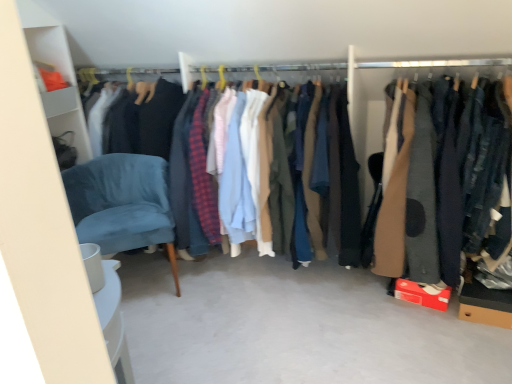
At what (x,y) coordinates should I click in order to perform the action: click on vacant area that lies between matte cotton shirts at center, which appears as the first clothing when viewed from the left, and velvet blue chair at lower left. Please return your answer as a coordinate pair (x, y). This screenshot has height=384, width=512. Looking at the image, I should click on [228, 307].